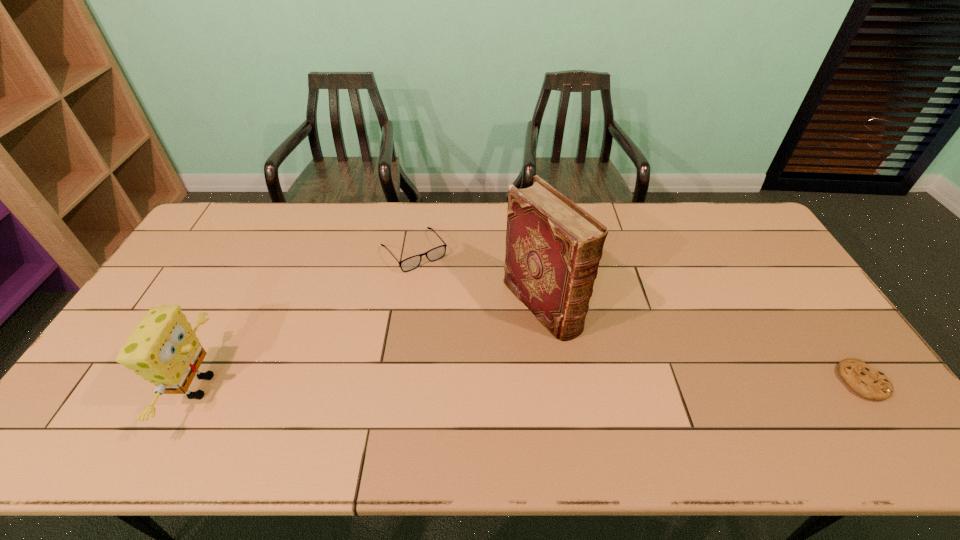
Where is `vacant space on the desktop that is between the sponge and the cookie and is positioned on the front-facing side of the third object from right to left`? vacant space on the desktop that is between the sponge and the cookie and is positioned on the front-facing side of the third object from right to left is located at coordinates (517, 384).

Identify the location of vacant space on the desktop that is between the sponge and the shortest object and is positioned on the spine side of the hardback book. The width and height of the screenshot is (960, 540). (x=619, y=383).